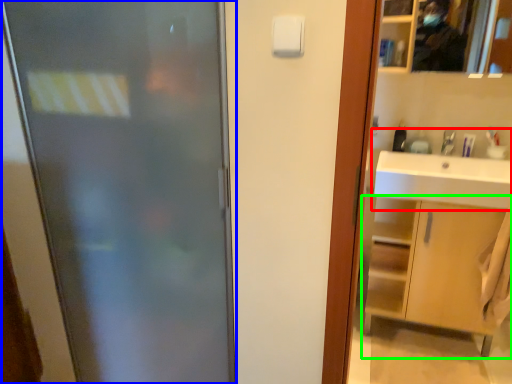
Question: Which object is the closest to the sink (highlighted by a red box)? Choose among these: door (highlighted by a blue box) or bathroom cabinet (highlighted by a green box).

Choices:
 (A) door
 (B) bathroom cabinet

Answer: (B)